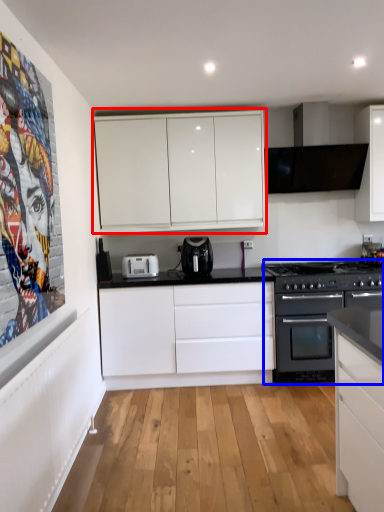
Question: Which object is further to the camera taking this photo, cabinetry (highlighted by a red box) or appliance (highlighted by a blue box)?

Choices:
 (A) cabinetry
 (B) appliance

Answer: (A)